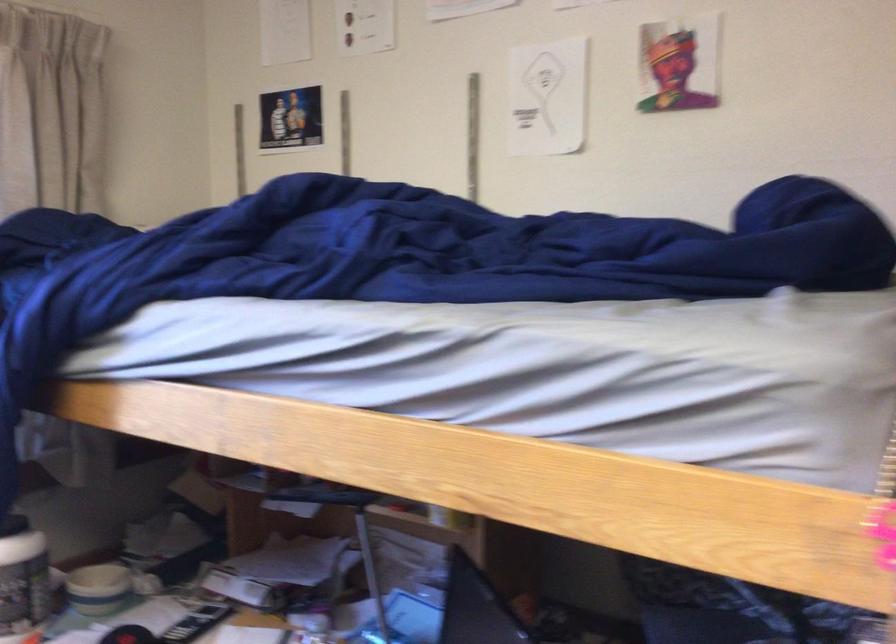
Where would you lift the white bowl? Please return your answer as a coordinate pair (x, y).

(98, 589)